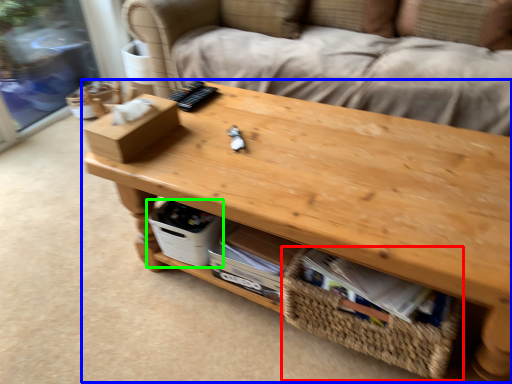
Question: Estimate the real-world distances between objects in this image. Which object is closer to basket (highlighted by a red box), table (highlighted by a blue box) or storage box (highlighted by a green box)?

Choices:
 (A) table
 (B) storage box

Answer: (A)